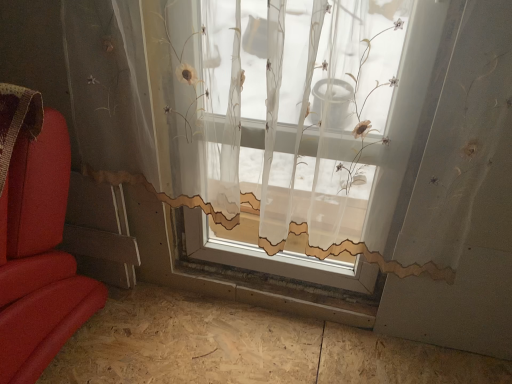
Locate an element on the screen. light brown plywood at lower left is located at coordinates (245, 348).

This screenshot has height=384, width=512. What do you see at coordinates (245, 348) in the screenshot? I see `light brown plywood at lower left` at bounding box center [245, 348].

What do you see at coordinates (301, 116) in the screenshot?
I see `translucent fabric window at center` at bounding box center [301, 116].

Find the location of a particular element. This screenshot has height=384, width=512. translucent fabric window at center is located at coordinates (301, 116).

Where is `light brown plywood at lower left`? This screenshot has width=512, height=384. light brown plywood at lower left is located at coordinates (245, 348).

Would you say light brown plywood at lower left is to the left or to the right of translucent fabric window at center in the picture?

In the image, light brown plywood at lower left appears on the right side of translucent fabric window at center.

Who is more distant, light brown plywood at lower left or translucent fabric window at center?

light brown plywood at lower left.

Which is behind, point (254, 329) or point (426, 185)?

The point (254, 329) is more distant.

From the image's perspective, is light brown plywood at lower left on top of translucent fabric window at center?

Incorrect, from the image's perspective, light brown plywood at lower left is lower than translucent fabric window at center.

From a real-world perspective, relative to translucent fabric window at center, is light brown plywood at lower left vertically above or below?

In terms of real-world spatial position, light brown plywood at lower left is below translucent fabric window at center.

Can you confirm if light brown plywood at lower left is wider than translucent fabric window at center?

Yes, light brown plywood at lower left is wider than translucent fabric window at center.

Can you confirm if light brown plywood at lower left is shorter than translucent fabric window at center?

Correct, light brown plywood at lower left is not as tall as translucent fabric window at center.

Between light brown plywood at lower left and translucent fabric window at center, which one has larger size?

With larger size is translucent fabric window at center.

Based on the photo, would you say light brown plywood at lower left is outside translucent fabric window at center?

light brown plywood at lower left lies outside translucent fabric window at center's area.

Is light brown plywood at lower left touching translucent fabric window at center?

No, light brown plywood at lower left is not making contact with translucent fabric window at center.

Is light brown plywood at lower left oriented towards translucent fabric window at center?

No, light brown plywood at lower left does not turn towards translucent fabric window at center.

At what (x,y) coordinates should I click in order to perform the action: click on plywood below the translucent fabric window at center (from the image's perspective). Please return your answer as a coordinate pair (x, y). This screenshot has width=512, height=384. Looking at the image, I should click on click(245, 348).

Which object is positioned more to the left, translucent fabric window at center or light brown plywood at lower left?

Positioned to the left is translucent fabric window at center.

Considering the relative positions of translucent fabric window at center and light brown plywood at lower left in the image provided, is translucent fabric window at center behind light brown plywood at lower left?

No, the depth of translucent fabric window at center is less than that of light brown plywood at lower left.

Which is farther from the camera, (x=315, y=26) or (x=322, y=375)?

The point (x=322, y=375) is farther.

From the image's perspective, is translucent fabric window at center on top of light brown plywood at lower left?

Correct, translucent fabric window at center appears higher than light brown plywood at lower left in the image.

In the scene shown: From a real-world perspective, is translucent fabric window at center above or below light brown plywood at lower left?

In terms of real-world spatial position, translucent fabric window at center is above light brown plywood at lower left.

Can you confirm if translucent fabric window at center is wider than light brown plywood at lower left?

No.

From their relative heights in the image, would you say translucent fabric window at center is taller or shorter than light brown plywood at lower left?

Clearly, translucent fabric window at center is taller compared to light brown plywood at lower left.

Is translucent fabric window at center smaller than light brown plywood at lower left?

Actually, translucent fabric window at center might be larger than light brown plywood at lower left.

Is light brown plywood at lower left a part of translucent fabric window at center?

No.

Would you consider translucent fabric window at center to be distant from light brown plywood at lower left?

translucent fabric window at center is actually quite close to light brown plywood at lower left.

Is translucent fabric window at center turned away from light brown plywood at lower left?

No, light brown plywood at lower left is not at the back of translucent fabric window at center.

Image resolution: width=512 pixels, height=384 pixels. I want to click on window on the left of light brown plywood at lower left, so click(x=301, y=116).

Find the location of a particular element. Image resolution: width=512 pixels, height=384 pixels. window above the light brown plywood at lower left (from a real-world perspective) is located at coordinates (301, 116).

In the image, there is a translucent fabric window at center. Where is `plywood below it (from a real-world perspective)`? This screenshot has height=384, width=512. plywood below it (from a real-world perspective) is located at coordinates (245, 348).